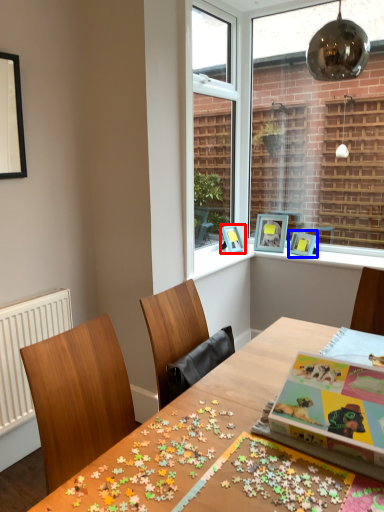
Question: Which of the following is the farthest to the observer, picture frame (highlighted by a red box) or picture frame (highlighted by a blue box)?

Choices:
 (A) picture frame
 (B) picture frame

Answer: (A)